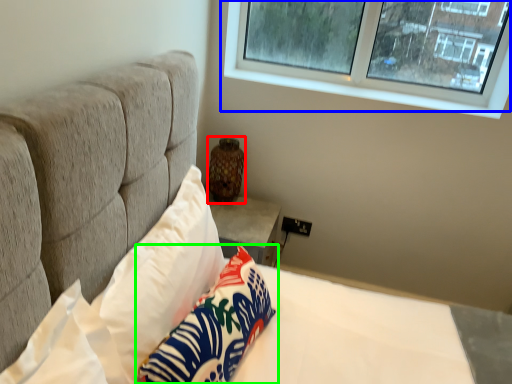
Question: Based on their relative distances, which object is farther from vase (highlighted by a red box)? Choose from window (highlighted by a blue box) and pillow (highlighted by a green box).

Choices:
 (A) window
 (B) pillow

Answer: (B)